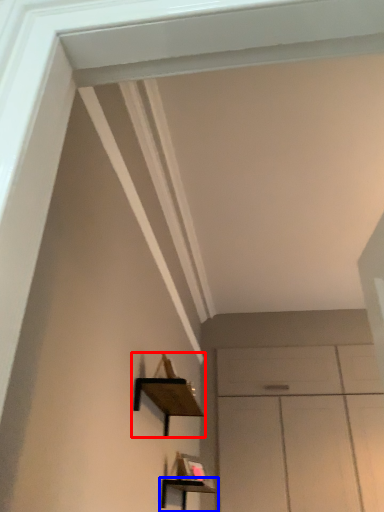
Question: Among these objects, which one is farthest to the camera, shelf (highlighted by a red box) or shelf (highlighted by a blue box)?

Choices:
 (A) shelf
 (B) shelf

Answer: (B)